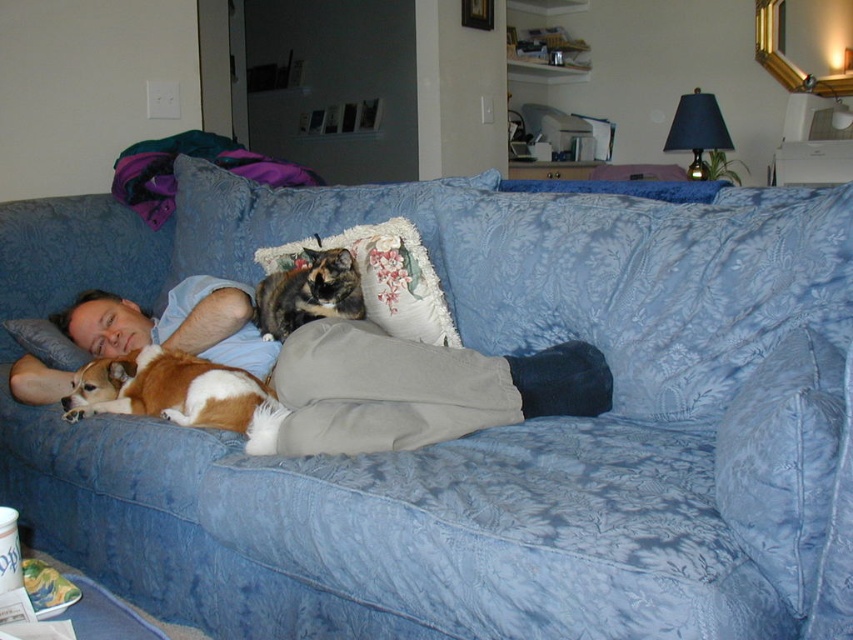
You are a photographer trying to capture the perfect shot of the brown and white fur dog at lower left. The camera you are using has a focus point at coordinate 0.6, 0.2. Will the focus point align with the dog?

The brown and white fur dog at lower left is at point (x=178, y=394), which is very close to the camera focus point at (x=170, y=384). The slight difference in coordinates means the focus point will align with the dog.

Please provide the 2D coordinates of the light blue fabric pants at center in the image. The coordinates should be in the format of a point with two decimal places, such as point 0.580, 0.411.

The 2D coordinates of the light blue fabric pants at center are point (350, 371).

You are a person who wants to sit on the blue floral fabric couch at center. There is a floral fabric pillow at center already on it. Can you sit without moving the pillow?

The blue floral fabric couch at center is much taller than the floral fabric pillow at center, so you can sit on the couch while keeping the pillow in place without needing to move it.